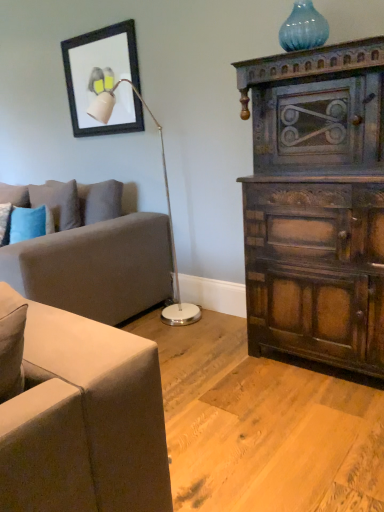
This screenshot has height=512, width=384. In order to click on free region on the left part of dark wood cabinet at right in this screenshot , I will do `click(215, 371)`.